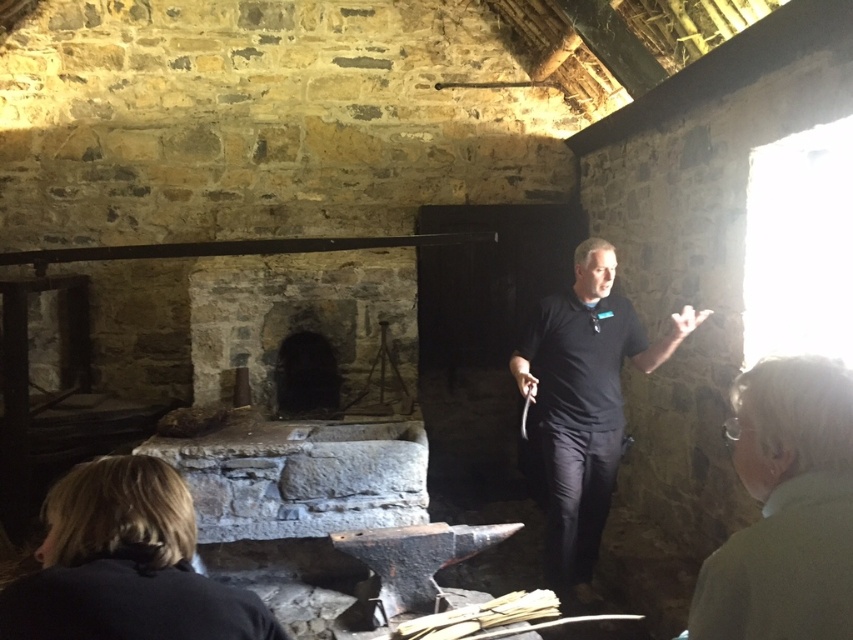
Can you confirm if blonde hair at lower left is positioned above dark stone fireplace at center?

No, blonde hair at lower left is not above dark stone fireplace at center.

Is point (171, 512) farther from viewer compared to point (196, 301)?

No, (171, 512) is in front of (196, 301).

You are a GUI agent. You are given a task and a screenshot of the screen. Output one action in this format:
    pyautogui.click(x=<x>, y=<y>)
    Task: Click on the blonde hair at lower left
    
    Given the screenshot: What is the action you would take?
    pyautogui.click(x=125, y=564)

Locate an element on the screen. This screenshot has width=853, height=640. blonde hair at lower left is located at coordinates (125, 564).

Between gray wool sweater at upper right and blonde hair at lower left, which one has less height?

With less height is blonde hair at lower left.

Can you confirm if gray wool sweater at upper right is bigger than blonde hair at lower left?

Yes.

Find the location of `gray wool sweater at upper right`. gray wool sweater at upper right is located at coordinates (785, 509).

Does black matte shirt at center lie behind dark stone fireplace at center?

No, it is in front of dark stone fireplace at center.

Which is behind, point (585, 253) or point (412, 296)?

Point (412, 296)

Identify the location of black matte shirt at center. (584, 404).